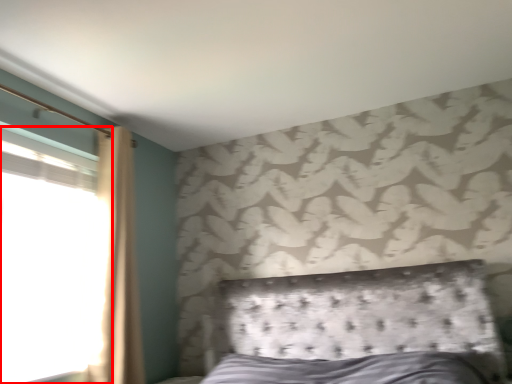
Question: From the image's perspective, what is the correct spatial positioning of window (annotated by the red box) in reference to curtain?

Choices:
 (A) above
 (B) below

Answer: (B)